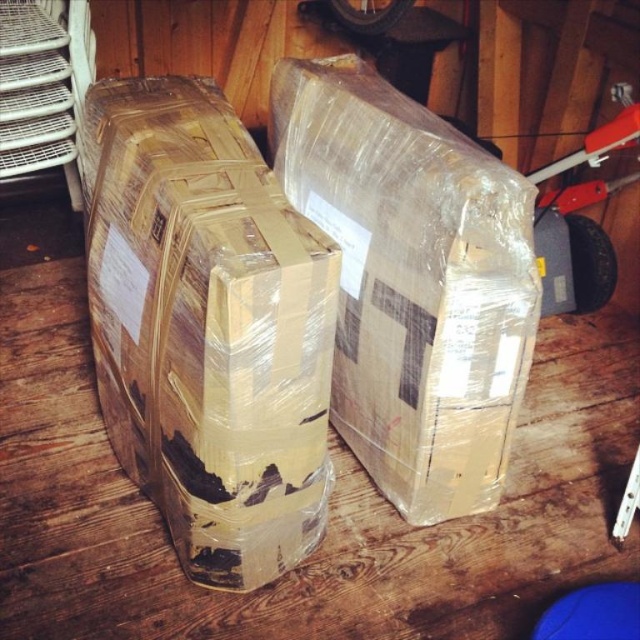
Between brown cardboard box at center and clear plastic box at center, which one appears on the left side from the viewer's perspective?

Positioned to the left is brown cardboard box at center.

Is brown cardboard box at center bigger than clear plastic box at center?

Indeed, brown cardboard box at center has a larger size compared to clear plastic box at center.

Describe the element at coordinates (208, 326) in the screenshot. I see `brown cardboard box at center` at that location.

This screenshot has width=640, height=640. I want to click on brown cardboard box at center, so click(x=208, y=326).